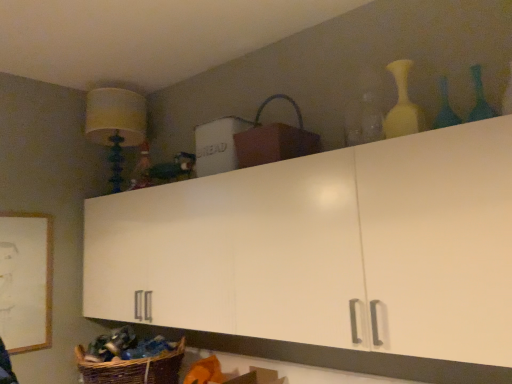
Question: Can you confirm if woven brown basket at lower left, positioned as the 1th basket in left-to-right order, is positioned to the right of green glass bottle at upper right, the 3th bottle positioned from the left?

Choices:
 (A) yes
 (B) no

Answer: (B)

Question: From a real-world perspective, is woven brown basket at lower left, positioned as the 1th basket in left-to-right order, located higher than green glass bottle at upper right, the 1th bottle positioned from the right?

Choices:
 (A) yes
 (B) no

Answer: (B)

Question: From the image's perspective, is woven brown basket at lower left, the second basket in the top-to-bottom sequence, above green glass bottle at upper right, the 1th bottle positioned from the right?

Choices:
 (A) yes
 (B) no

Answer: (B)

Question: From the image's perspective, is woven brown basket at lower left, the second basket in the top-to-bottom sequence, beneath green glass bottle at upper right, the 1th bottle positioned from the right?

Choices:
 (A) no
 (B) yes

Answer: (B)

Question: Could you tell me if woven brown basket at lower left, the second basket in the top-to-bottom sequence, is facing green glass bottle at upper right, the 1th bottle positioned from the right?

Choices:
 (A) yes
 (B) no

Answer: (B)

Question: Would you say green glass bottle at upper right, the 1th bottle positioned from the right, is inside or outside blue glass bottle at upper right, acting as the 2th bottle starting from the right?

Choices:
 (A) outside
 (B) inside

Answer: (A)

Question: In the image, is green glass bottle at upper right, the 3th bottle positioned from the left, on the left side or the right side of blue glass bottle at upper right, acting as the 2th bottle starting from the right?

Choices:
 (A) left
 (B) right

Answer: (B)

Question: In the image, is green glass bottle at upper right, the 3th bottle positioned from the left, positioned in front of or behind blue glass bottle at upper right, acting as the 2th bottle starting from the right?

Choices:
 (A) front
 (B) behind

Answer: (A)

Question: Considering the positions of green glass bottle at upper right, the 1th bottle positioned from the right, and blue glass bottle at upper right, acting as the 2th bottle starting from the right, in the image, is green glass bottle at upper right, the 1th bottle positioned from the right, wider or thinner than blue glass bottle at upper right, acting as the 2th bottle starting from the right,?

Choices:
 (A) wide
 (B) thin

Answer: (B)

Question: Relative to white wooden picture frame at lower left, is blue glass bottle at upper right, marked as the 2th bottle in a left-to-right arrangement, in front or behind?

Choices:
 (A) front
 (B) behind

Answer: (A)

Question: From a real-world perspective, is blue glass bottle at upper right, marked as the 2th bottle in a left-to-right arrangement, positioned above or below white wooden picture frame at lower left?

Choices:
 (A) above
 (B) below

Answer: (A)

Question: Considering the relative positions of blue glass bottle at upper right, marked as the 2th bottle in a left-to-right arrangement, and white wooden picture frame at lower left in the image provided, is blue glass bottle at upper right, marked as the 2th bottle in a left-to-right arrangement, to the left or to the right of white wooden picture frame at lower left?

Choices:
 (A) right
 (B) left

Answer: (A)

Question: Looking at the image, does blue glass bottle at upper right, marked as the 2th bottle in a left-to-right arrangement, seem bigger or smaller compared to white wooden picture frame at lower left?

Choices:
 (A) big
 (B) small

Answer: (B)

Question: Is point (110, 145) closer or farther from the camera than point (44, 276)?

Choices:
 (A) closer
 (B) farther

Answer: (B)

Question: Visually, is matte yellow fabric lampshade at upper left positioned to the left or to the right of white wooden picture frame at lower left?

Choices:
 (A) right
 (B) left

Answer: (A)